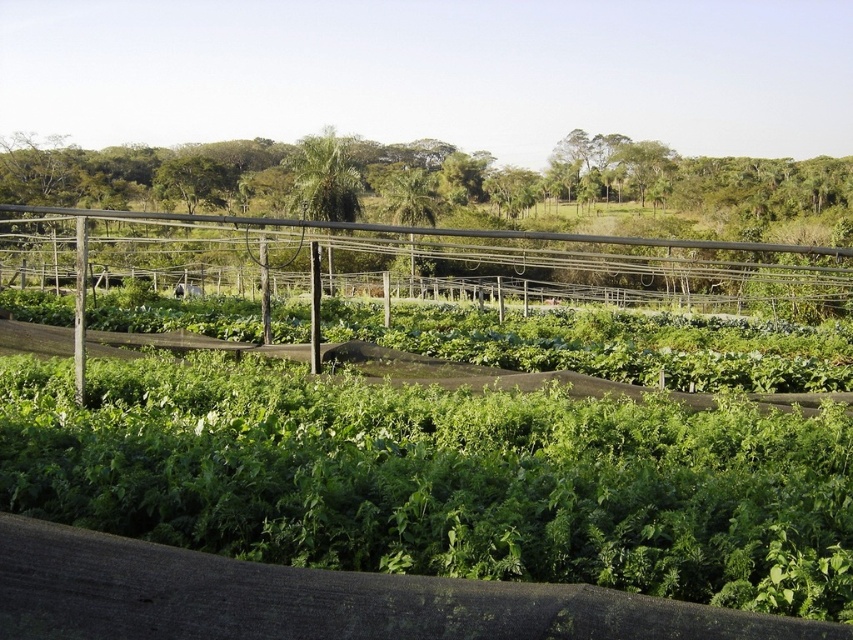
You are a farmer checking the crops in the field. You notice the green leafy plant at center and the wooden fence at center. Which object is closer to the ground?

The green leafy plant at center is closer to the ground because it is positioned under the wooden fence at center.

You are standing in the middle of the farm and see the green leafy plant at center and the wooden fence at center. Which object is positioned to the right side?

The green leafy plant at center is positioned to the right of the wooden fence at center.

You are a farmer checking the spacing between crops. You see the green leafy plant at center and the wooden fence at center in the image. Which one is narrower?

The green leafy plant at center is narrower than the wooden fence at center.